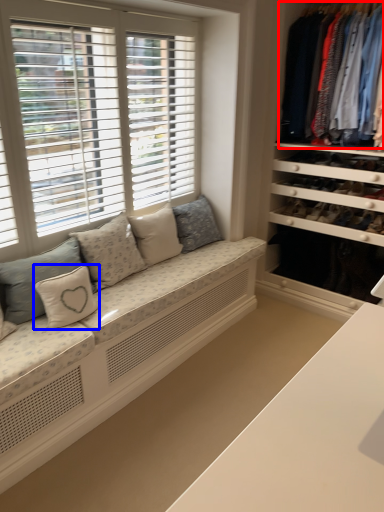
Question: Which object appears farthest to the camera in this image, clothing (highlighted by a red box) or pillow (highlighted by a blue box)?

Choices:
 (A) clothing
 (B) pillow

Answer: (A)